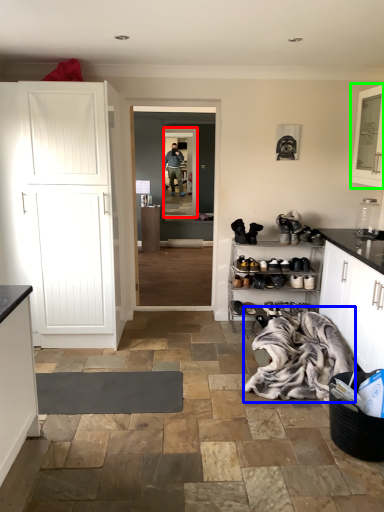
Question: Which object is the farthest from glass door (highlighted by a red box)? Choose among these: laundry (highlighted by a blue box) or cabinetry (highlighted by a green box).

Choices:
 (A) laundry
 (B) cabinetry

Answer: (A)